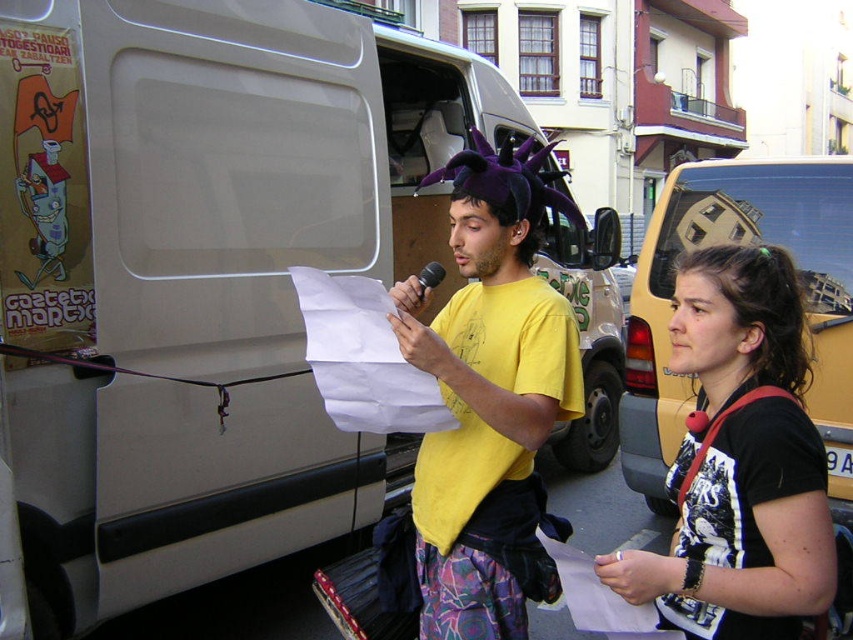
Can you confirm if yellow t-shirt at center is wider than black plastic microphone at center?

Indeed, yellow t-shirt at center has a greater width compared to black plastic microphone at center.

Does yellow t-shirt at center appear under black plastic microphone at center?

Yes, yellow t-shirt at center is below black plastic microphone at center.

Does point (577, 385) come closer to viewer compared to point (444, 268)?

Yes, it is in front of point (444, 268).

Find the location of a particular element. This screenshot has height=640, width=853. yellow t-shirt at center is located at coordinates (489, 397).

What do you see at coordinates (489, 397) in the screenshot? I see `yellow t-shirt at center` at bounding box center [489, 397].

Which is behind, point (515, 333) or point (590, 596)?

Point (515, 333)

Identify the location of yellow t-shirt at center. (489, 397).

In the scene shown: Can you confirm if matte white van at center is taller than yellow t-shirt at center?

Indeed, matte white van at center has a greater height compared to yellow t-shirt at center.

Where is `matte white van at center`? This screenshot has width=853, height=640. matte white van at center is located at coordinates (202, 275).

Find the location of `matte white van at center`. matte white van at center is located at coordinates (202, 275).